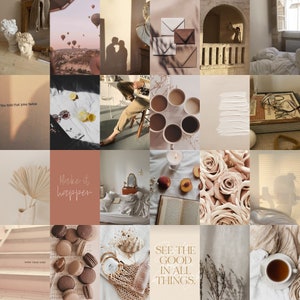
The width and height of the screenshot is (300, 300). I want to click on cup, so click(x=273, y=273), click(x=192, y=128), click(x=173, y=140), click(x=199, y=113), click(x=176, y=100), click(x=156, y=106), click(x=160, y=130).